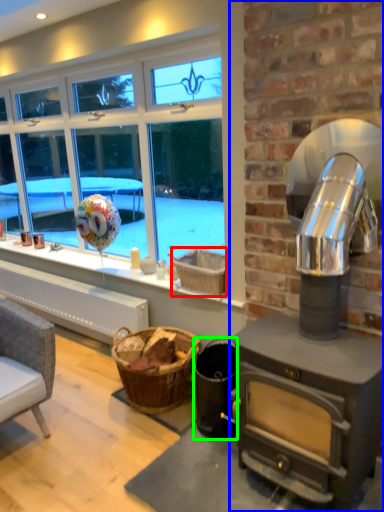
Question: Which is nearer to the basket (highlighted by a red box)? fireplace (highlighted by a blue box) or appliance (highlighted by a green box).

Choices:
 (A) fireplace
 (B) appliance

Answer: (B)